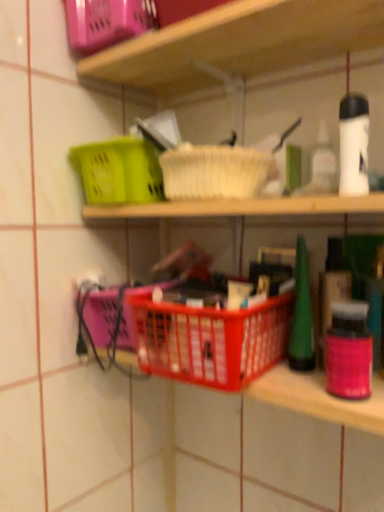
Question: Are plastic basket at center and matte plastic basket at upper left making contact?

Choices:
 (A) yes
 (B) no

Answer: (B)

Question: Considering the relative sizes of plastic basket at center and matte plastic basket at upper left in the image provided, is plastic basket at center taller than matte plastic basket at upper left?

Choices:
 (A) yes
 (B) no

Answer: (A)

Question: From the image's perspective, does plastic basket at center appear higher than matte plastic basket at upper left?

Choices:
 (A) yes
 (B) no

Answer: (B)

Question: Is plastic basket at center surrounding matte plastic basket at upper left?

Choices:
 (A) yes
 (B) no

Answer: (B)

Question: Considering the relative sizes of plastic basket at center and matte plastic basket at upper left in the image provided, is plastic basket at center thinner than matte plastic basket at upper left?

Choices:
 (A) no
 (B) yes

Answer: (A)

Question: Considering their positions, is plastic basket at center located in front of or behind red plastic basket at center?

Choices:
 (A) behind
 (B) front

Answer: (B)

Question: Does point (319, 197) appear closer or farther from the camera than point (218, 355)?

Choices:
 (A) closer
 (B) farther

Answer: (A)

Question: From a real-world perspective, is plastic basket at center positioned above or below red plastic basket at center?

Choices:
 (A) below
 (B) above

Answer: (B)

Question: Is plastic basket at center to the left or to the right of red plastic basket at center in the image?

Choices:
 (A) left
 (B) right

Answer: (A)

Question: In terms of height, does red plastic basket at center look taller or shorter compared to matte plastic basket at upper left?

Choices:
 (A) short
 (B) tall

Answer: (B)

Question: Does point (140, 355) appear closer or farther from the camera than point (86, 40)?

Choices:
 (A) farther
 (B) closer

Answer: (B)

Question: From the image's perspective, is red plastic basket at center positioned above or below matte plastic basket at upper left?

Choices:
 (A) above
 (B) below

Answer: (B)

Question: Choose the correct answer: Is red plastic basket at center inside matte plastic basket at upper left or outside it?

Choices:
 (A) inside
 (B) outside

Answer: (B)

Question: From their relative heights in the image, would you say red plastic basket at center is taller or shorter than plastic basket at center?

Choices:
 (A) short
 (B) tall

Answer: (A)

Question: Is red plastic basket at center situated inside plastic basket at center or outside?

Choices:
 (A) outside
 (B) inside

Answer: (B)